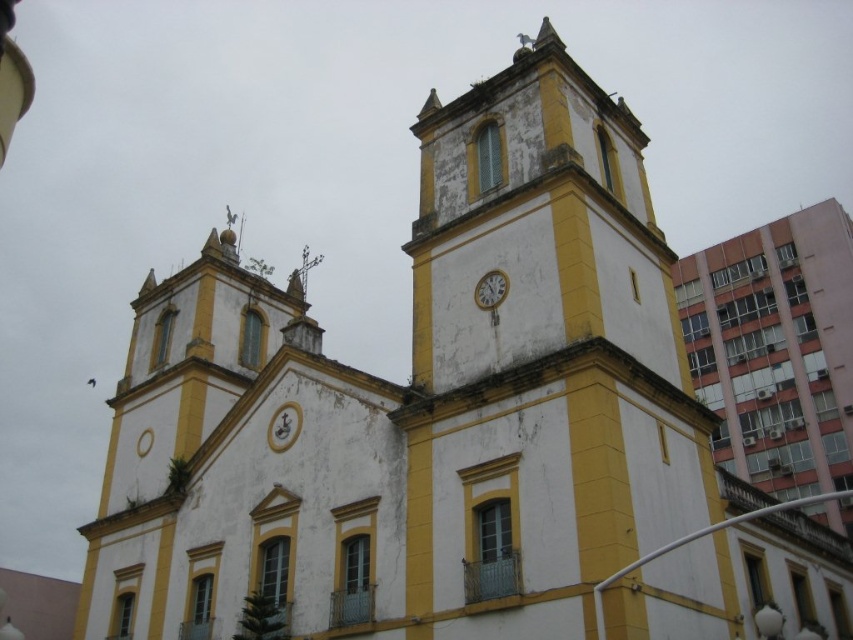
You are standing in front of the historic building and want to take a photo of both the yellow matte clock tower at center and the metallic silver clock at center. Which object should you focus on first to ensure both are in the frame?

You should focus on the yellow matte clock tower at center first because it is closer to you than the metallic silver clock at center, ensuring both are in the frame.

You are an architect examining the historic building. You notice the yellow matte clock tower at center and the metallic silver clock at center. Which of these two objects is larger in size?

The yellow matte clock tower at center is bigger than the metallic silver clock at center.

You are standing in front of the historic building and want to take a photo of the yellow matte clock tower at center. If your camera can focus on objects up to 30 meters away, will it be able to capture the clock tower clearly?

The yellow matte clock tower at center is 31.47 meters away from the viewer. Since the camera can only focus up to 30 meters, it will not be able to capture the clock tower clearly.